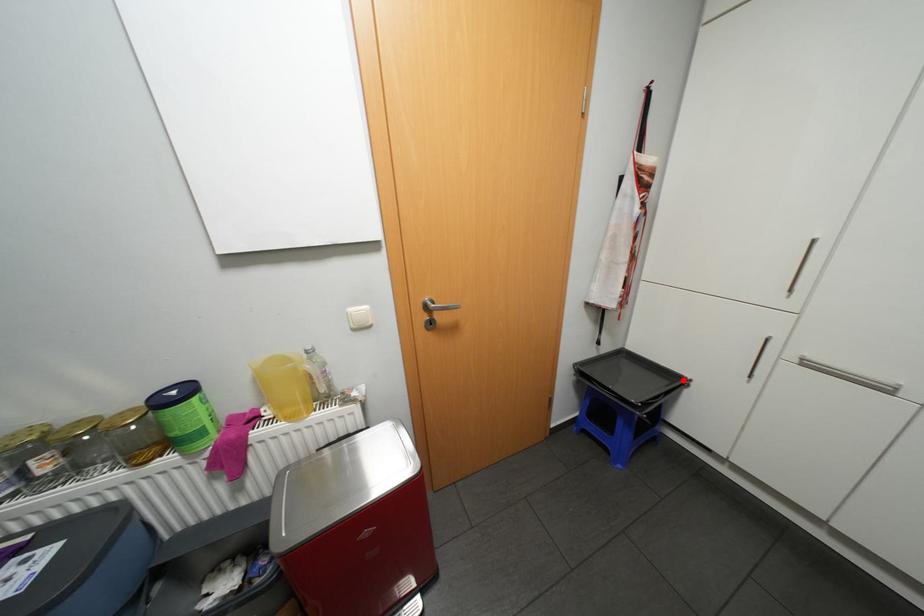
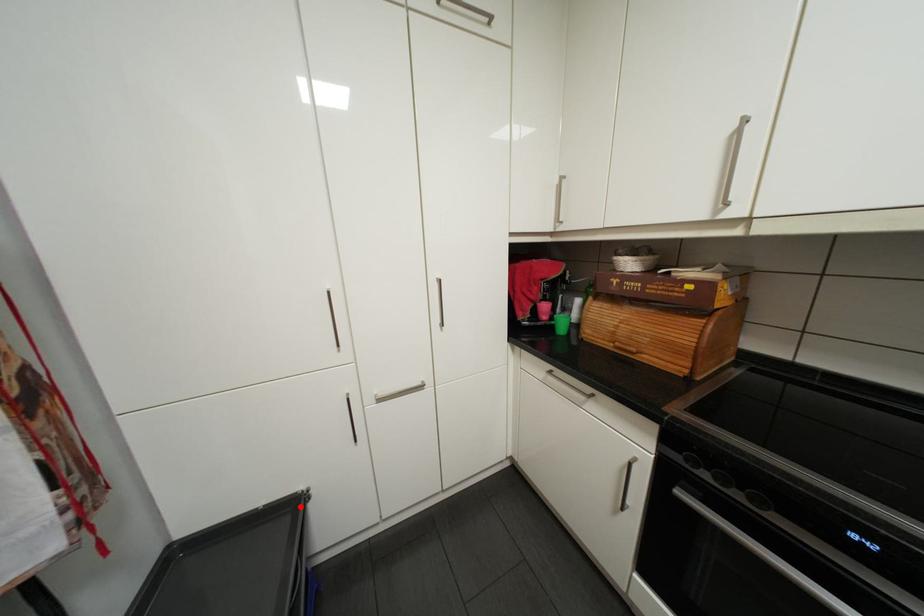
I am providing you with two images of the same scene from different viewpoints. A red point is marked on the first image and another point is marked on the second image. Is the red point in image1 aligned with the point shown in image2?

Yes